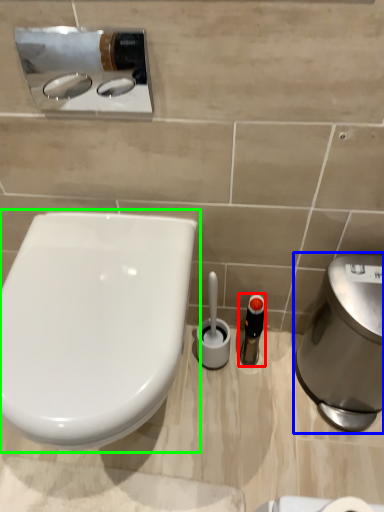
Question: Based on their relative distances, which object is farther from toiletry (highlighted by a red box)? Choose from hand dryer (highlighted by a blue box) and toilet (highlighted by a green box).

Choices:
 (A) hand dryer
 (B) toilet

Answer: (B)